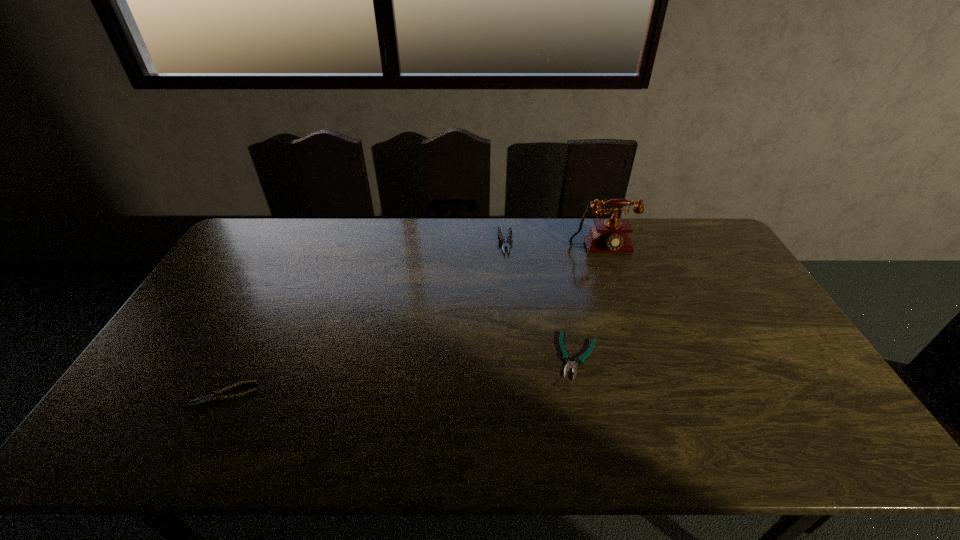
Identify which object is the second closest to the second nearest pliers. Please provide its 2D coordinates. Your answer should be formatted as a tuple, i.e. [(x, y)], where the tuple contains the x and y coordinates of a point satisfying the conditions above.

[(509, 241)]

Point out which object is positioned as the third nearest to the farthest pliers. Please provide its 2D coordinates. Your answer should be formatted as a tuple, i.e. [(x, y)], where the tuple contains the x and y coordinates of a point satisfying the conditions above.

[(215, 397)]

This screenshot has width=960, height=540. In order to click on the second closest pliers to the second pliers from right to left in this screenshot , I will do `click(215, 397)`.

Locate which pliers ranks in proximity to the nearest object. Please provide its 2D coordinates. Your answer should be formatted as a tuple, i.e. [(x, y)], where the tuple contains the x and y coordinates of a point satisfying the conditions above.

[(566, 357)]

Image resolution: width=960 pixels, height=540 pixels. I want to click on vacant region that satisfies the following two spatial constraints: 1. at the gripping part of the rightmost pliers; 2. on the left side of the second pliers from left to right, so click(514, 356).

I want to click on vacant space that satisfies the following two spatial constraints: 1. at the gripping part of the second pliers from left to right; 2. on the right side of the second farthest pliers, so click(x=514, y=356).